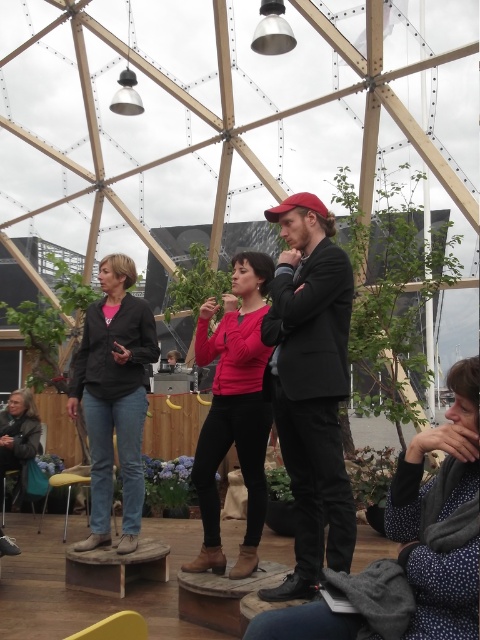
Which is behind, point (238, 563) or point (115, 340)?

Point (115, 340)

Which of these two, pink matte jacket at center or denim jacket at center, stands taller?

With more height is denim jacket at center.

Who is more distant from viewer, (229, 353) or (96, 524)?

The point (229, 353) is more distant.

This screenshot has height=640, width=480. I want to click on pink matte jacket at center, so coord(233,410).

Which is below, matte black suit at center or pink matte jacket at center?

pink matte jacket at center is lower down.

Which is behind, point (312, 506) or point (248, 385)?

The point (248, 385) is more distant.

Where is `matte black suit at center`? The image size is (480, 640). matte black suit at center is located at coordinates (311, 387).

Is matte black suit at center bigger than gray woolen scarf at lower left?

Incorrect, matte black suit at center is not larger than gray woolen scarf at lower left.

Find the location of a particular element. matte black suit at center is located at coordinates (311, 387).

Identify the location of matte black suit at center. (311, 387).